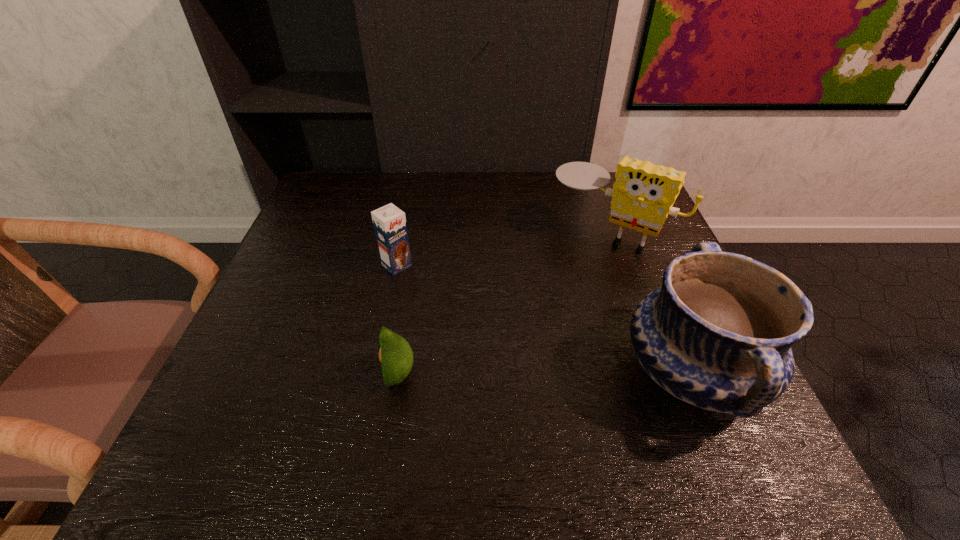
Locate an element on the screen. Image resolution: width=960 pixels, height=540 pixels. vacant spot on the desktop that is between the shortest object and the pottery and is positioned on the front-facing side of the sponge is located at coordinates (512, 374).

The image size is (960, 540). Find the location of `free space on the desktop that is between the avocado and the pottery and is positioned on the front label of the chocolate milk`. free space on the desktop that is between the avocado and the pottery and is positioned on the front label of the chocolate milk is located at coordinates (520, 374).